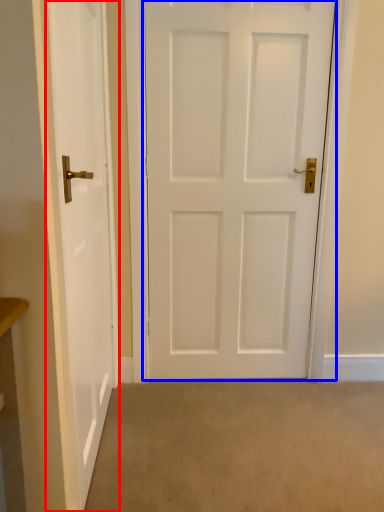
Question: Which of the following is the farthest to the observer, door (highlighted by a red box) or door (highlighted by a blue box)?

Choices:
 (A) door
 (B) door

Answer: (B)